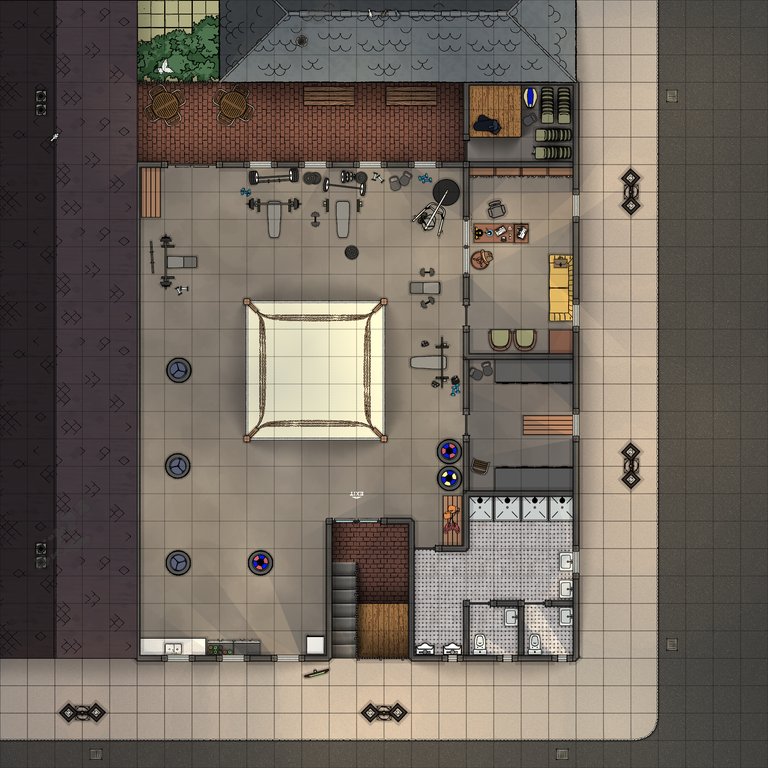
Locate an element on the screen. The width and height of the screenshot is (768, 768). benches is located at coordinates (439, 362), (343, 210), (279, 216), (187, 260).